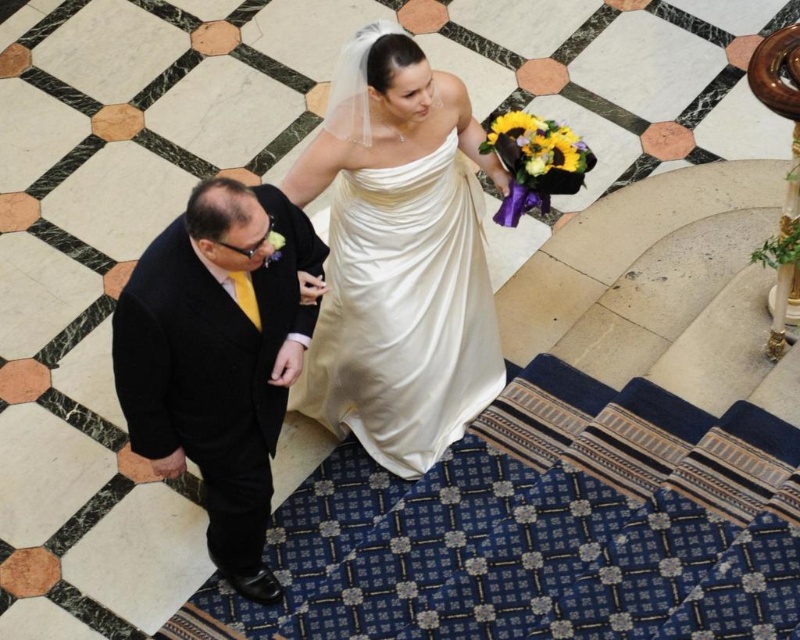
You are a photographer capturing the wedding couple descending the staircase. You notice the ivory satin dress at center and the yellow fabric bouquet at center. Which object is positioned lower in the image?

The ivory satin dress at center is located below the yellow fabric bouquet at center, so the ivory satin dress at center is positioned lower in the image.

You are a photographer at the wedding. You want to take a photo of the black wool suit at left and the yellow fabric bouquet at center. Which object is closer to you?

The black wool suit at left is closer to the viewer than the yellow fabric bouquet at center.